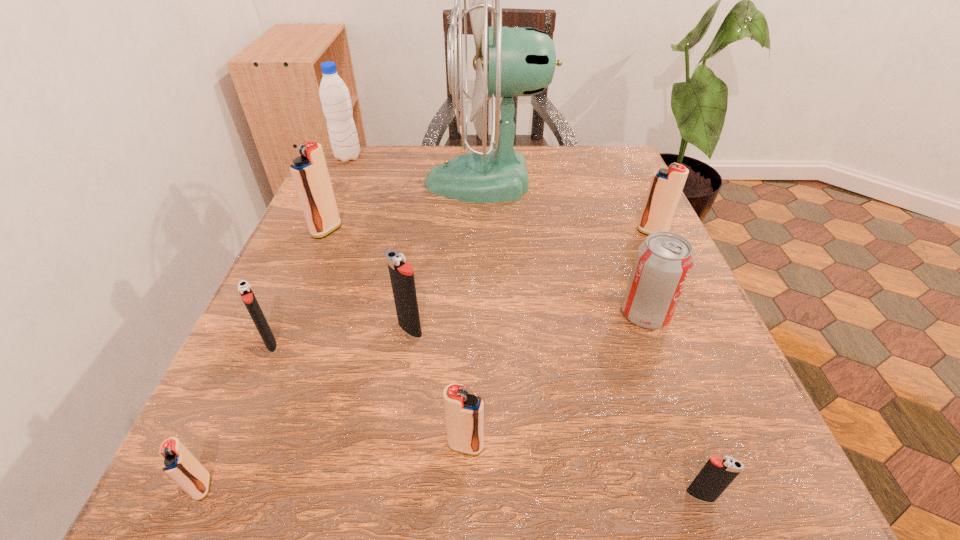
Where is `soda can`? This screenshot has width=960, height=540. soda can is located at coordinates (663, 262).

Image resolution: width=960 pixels, height=540 pixels. What are the coordinates of `the leftmost black igniter` in the screenshot? It's located at (244, 289).

Where is `the third igniter from right to left`? This screenshot has width=960, height=540. the third igniter from right to left is located at coordinates (464, 413).

Identify the location of the fifth farthest igniter. The height and width of the screenshot is (540, 960). point(464,413).

Where is `the smallest red igniter`? The height and width of the screenshot is (540, 960). the smallest red igniter is located at coordinates (179, 464).

Locate an element on the screen. the rightmost black igniter is located at coordinates (717, 474).

The height and width of the screenshot is (540, 960). In order to click on the nearest black igniter in this screenshot , I will do `click(717, 474)`.

I want to click on free spot located in front of the fan, directing airflow, so click(x=329, y=182).

At what (x,y) coordinates should I click in order to perform the action: click on free space located 0.120m in front of the fan, directing airflow. Please return your answer as a coordinate pair (x, y). Looking at the image, I should click on (372, 182).

You are a GUI agent. You are given a task and a screenshot of the screen. Output one action in this format:
    pyautogui.click(x=<x>, y=<y>)
    Task: Click on the vacant area situated 0.120m in front of the fan, directing airflow
    The width and height of the screenshot is (960, 540).
    Given the screenshot: What is the action you would take?
    pos(372,182)